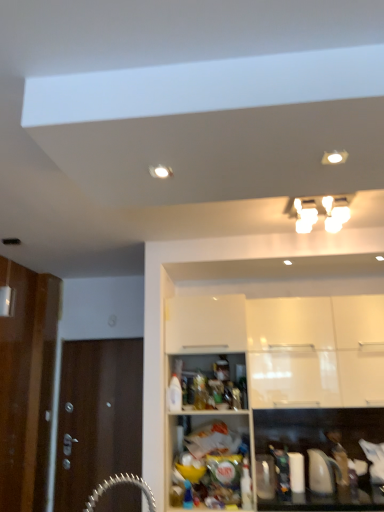
Image resolution: width=384 pixels, height=512 pixels. Describe the element at coordinates (335, 212) in the screenshot. I see `white glossy light fixture at upper center` at that location.

The image size is (384, 512). What are the coordinates of `white glossy cabinet at upper center, the 1th cabinetry viewed from the front` in the screenshot? It's located at (278, 374).

Where is `white glossy cabinet at upper right, arranged as the 2th cabinetry when viewed from the front`? white glossy cabinet at upper right, arranged as the 2th cabinetry when viewed from the front is located at coordinates (292, 353).

The width and height of the screenshot is (384, 512). What are the coordinates of `white glossy light fixture at upper center` in the screenshot? It's located at (335, 212).

Measure the distance from white glossy cabinet at upper center, the 1th cabinetry viewed from the front, to translucent plastic bottle at center.

white glossy cabinet at upper center, the 1th cabinetry viewed from the front, is 22.64 inches away from translucent plastic bottle at center.

Is white glossy cabinet at upper center, the second cabinetry viewed from the back, closer to the viewer compared to translucent plastic bottle at center?

Yes, the depth of white glossy cabinet at upper center, the second cabinetry viewed from the back, is less than that of translucent plastic bottle at center.

Based on the photo, could you tell me if white glossy cabinet at upper center, the 1th cabinetry viewed from the front, is facing translucent plastic bottle at center?

Yes, white glossy cabinet at upper center, the 1th cabinetry viewed from the front, is aimed at translucent plastic bottle at center.

Can you confirm if white glossy cabinet at upper center, the second cabinetry viewed from the back, is bigger than translucent plastic bottle at center?

Yes, white glossy cabinet at upper center, the second cabinetry viewed from the back, is bigger than translucent plastic bottle at center.

Would you consider white glossy light fixture at upper center to be distant from brown wooden door at left?

Yes, white glossy light fixture at upper center is far from brown wooden door at left.

Is point (309, 210) positioned in front of point (103, 461)?

Yes, it is.

Is white glossy light fixture at upper center smaller than brown wooden door at left?

Indeed, white glossy light fixture at upper center has a smaller size compared to brown wooden door at left.

In the scene shown: Between white glossy light fixture at upper center and brown wooden door at left, which one has larger width?

white glossy light fixture at upper center.

Does point (73, 483) come in front of point (283, 307)?

No, it is not.

Does brown wooden door at left have a lesser width compared to white glossy cabinet at upper right, arranged as the 2th cabinetry when viewed from the front?

Yes, brown wooden door at left is thinner than white glossy cabinet at upper right, arranged as the 2th cabinetry when viewed from the front.

Is brown wooden door at left taller than white glossy cabinet at upper right, which is the first cabinetry from back to front?

Indeed, brown wooden door at left has a greater height compared to white glossy cabinet at upper right, which is the first cabinetry from back to front.

In the image, is white glossy cabinet at upper right, arranged as the 2th cabinetry when viewed from the front, positioned in front of or behind white glossy light fixture at upper center?

white glossy cabinet at upper right, arranged as the 2th cabinetry when viewed from the front, is behind white glossy light fixture at upper center.

Looking at the image, does white glossy cabinet at upper right, arranged as the 2th cabinetry when viewed from the front, seem bigger or smaller compared to white glossy light fixture at upper center?

Clearly, white glossy cabinet at upper right, arranged as the 2th cabinetry when viewed from the front, is larger in size than white glossy light fixture at upper center.

From a real-world perspective, is white glossy cabinet at upper right, arranged as the 2th cabinetry when viewed from the front, positioned over white glossy light fixture at upper center based on gravity?

No, from a real-world perspective, white glossy cabinet at upper right, arranged as the 2th cabinetry when viewed from the front, is not on top of white glossy light fixture at upper center.

The image size is (384, 512). Find the location of `light fixture that appears in front of the white glossy cabinet at upper right, which is the first cabinetry from back to front`. light fixture that appears in front of the white glossy cabinet at upper right, which is the first cabinetry from back to front is located at coordinates (335, 212).

Considering the relative sizes of translucent plastic bottle at center and white glossy cabinet at upper center, the 1th cabinetry viewed from the front, in the image provided, is translucent plastic bottle at center shorter than white glossy cabinet at upper center, the 1th cabinetry viewed from the front,?

Yes.

Is translucent plastic bottle at center wider or thinner than white glossy cabinet at upper center, the second cabinetry viewed from the back?

translucent plastic bottle at center is wider than white glossy cabinet at upper center, the second cabinetry viewed from the back.

Considering the positions of objects translucent plastic bottle at center and white glossy cabinet at upper center, the 1th cabinetry viewed from the front, in the image provided, who is behind, translucent plastic bottle at center or white glossy cabinet at upper center, the 1th cabinetry viewed from the front,?

translucent plastic bottle at center is behind.

Which is behind, point (220, 366) or point (205, 441)?

The point (220, 366) is farther.

Between translucent plastic bottle at center and white glossy light fixture at upper center, which one is positioned behind?

Positioned behind is translucent plastic bottle at center.

Considering the sizes of objects translucent plastic bottle at center and white glossy light fixture at upper center in the image provided, who is wider, translucent plastic bottle at center or white glossy light fixture at upper center?

white glossy light fixture at upper center is wider.

Which is in front, point (225, 375) or point (314, 215)?

The point (314, 215) is more forward.

Would you say translucent plastic bottle at center is a long distance from white glossy light fixture at upper center?

Yes, translucent plastic bottle at center and white glossy light fixture at upper center are quite far apart.

Considering the relative sizes of white glossy cabinet at upper right, which is the first cabinetry from back to front, and translucent plastic bottle at center in the image provided, is white glossy cabinet at upper right, which is the first cabinetry from back to front, smaller than translucent plastic bottle at center?

No.

Is white glossy cabinet at upper right, which is the first cabinetry from back to front, to the right of translucent plastic bottle at center from the viewer's perspective?

Indeed, white glossy cabinet at upper right, which is the first cabinetry from back to front, is positioned on the right side of translucent plastic bottle at center.

Is white glossy cabinet at upper right, which is the first cabinetry from back to front, far away from translucent plastic bottle at center?

No, there isn't a large distance between white glossy cabinet at upper right, which is the first cabinetry from back to front, and translucent plastic bottle at center.

Find the location of `beverage that appears on the left of white glossy cabinet at upper center, the second cabinetry viewed from the back`. beverage that appears on the left of white glossy cabinet at upper center, the second cabinetry viewed from the back is located at coordinates (221, 368).

Where is `door located below the white glossy light fixture at upper center (from the image's perspective)`? door located below the white glossy light fixture at upper center (from the image's perspective) is located at coordinates (97, 417).

Based on the photo, estimate the real-world distances between objects in this image. Which object is closer to white glossy cabinet at upper right, which is the first cabinetry from back to front, white glossy cabinet at upper center, the second cabinetry viewed from the back, or translucent plastic bottle at center?

The object closer to white glossy cabinet at upper right, which is the first cabinetry from back to front, is white glossy cabinet at upper center, the second cabinetry viewed from the back.

Looking at this image, from the image, which object appears to be nearer to translucent plastic bottle at center, white glossy cabinet at upper center, the second cabinetry viewed from the back, or brown wooden door at left?

Among the two, white glossy cabinet at upper center, the second cabinetry viewed from the back, is located nearer to translucent plastic bottle at center.

Looking at the image, which one is located further to white glossy light fixture at upper center, white glossy cabinet at upper right, arranged as the 2th cabinetry when viewed from the front, or translucent plastic bottle at center?

translucent plastic bottle at center is further to white glossy light fixture at upper center.

When comparing their distances from white glossy light fixture at upper center, does white glossy cabinet at upper center, the 1th cabinetry viewed from the front, or white glossy cabinet at upper right, which is the first cabinetry from back to front, seem closer?

The object closer to white glossy light fixture at upper center is white glossy cabinet at upper right, which is the first cabinetry from back to front.

Considering their positions, is translucent plastic bottle at center positioned closer to white glossy cabinet at upper right, arranged as the 2th cabinetry when viewed from the front, than white glossy light fixture at upper center?

translucent plastic bottle at center is closer to white glossy cabinet at upper right, arranged as the 2th cabinetry when viewed from the front.

When comparing their distances from translucent plastic bottle at center, does white glossy cabinet at upper right, which is the first cabinetry from back to front, or white glossy light fixture at upper center seem closer?

Based on the image, white glossy cabinet at upper right, which is the first cabinetry from back to front, appears to be nearer to translucent plastic bottle at center.

Based on their spatial positions, is translucent plastic bottle at center or white glossy light fixture at upper center closer to white glossy cabinet at upper center, the second cabinetry viewed from the back?

translucent plastic bottle at center is closer to white glossy cabinet at upper center, the second cabinetry viewed from the back.

Looking at this image, looking at the image, which one is located closer to translucent plastic bottle at center, brown wooden door at left or white glossy cabinet at upper right, arranged as the 2th cabinetry when viewed from the front?

white glossy cabinet at upper right, arranged as the 2th cabinetry when viewed from the front.

Where is `beverage between brown wooden door at left and white glossy cabinet at upper center, the 1th cabinetry viewed from the front, in the horizontal direction`? beverage between brown wooden door at left and white glossy cabinet at upper center, the 1th cabinetry viewed from the front, in the horizontal direction is located at coordinates (221, 368).

Where is `cabinetry between brown wooden door at left and white glossy cabinet at upper right, which is the first cabinetry from back to front, in the horizontal direction`? cabinetry between brown wooden door at left and white glossy cabinet at upper right, which is the first cabinetry from back to front, in the horizontal direction is located at coordinates (278, 374).

Identify the location of cabinetry between translucent plastic bottle at center and white glossy cabinet at upper right, arranged as the 2th cabinetry when viewed from the front. (278, 374).

I want to click on beverage situated between brown wooden door at left and white glossy cabinet at upper right, which is the first cabinetry from back to front, from left to right, so click(x=221, y=368).